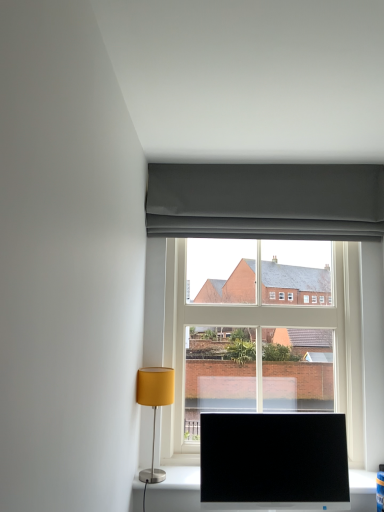
Question: Considering the positions of matte gray curtain at upper center and matte yellow fabric lampshade at lower left in the image, is matte gray curtain at upper center bigger or smaller than matte yellow fabric lampshade at lower left?

Choices:
 (A) big
 (B) small

Answer: (A)

Question: Is matte gray curtain at upper center taller or shorter than matte yellow fabric lampshade at lower left?

Choices:
 (A) short
 (B) tall

Answer: (A)

Question: Which object is the closest to the matte yellow fabric lampshade at lower left?

Choices:
 (A) black glossy monitor at lower center
 (B) matte gray curtain at upper center
 (C) clear glass window at center

Answer: (A)

Question: Based on their relative distances, which object is nearer to the matte yellow fabric lampshade at lower left?

Choices:
 (A) black glossy monitor at lower center
 (B) matte gray curtain at upper center
 (C) clear glass window at center

Answer: (A)